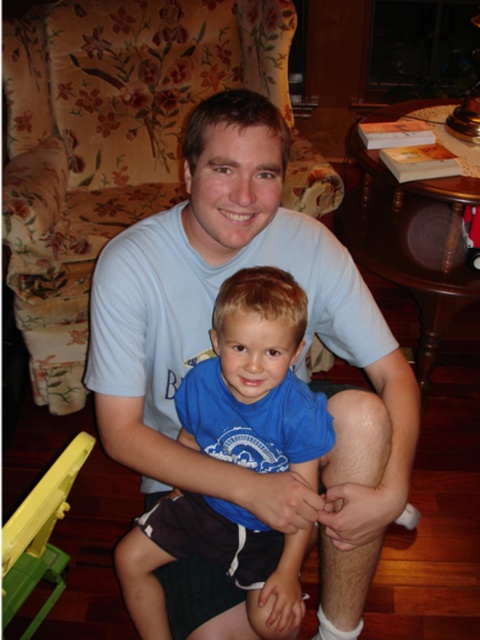
You are a photographer setting up for a family portrait. The floral fabric armchair at upper left is in the scene. To ensure both the subjects and the armchair are in focus, what should be the minimum distance you set your camera focus? Please provide your answer in feet based on the given information.

The floral fabric armchair at upper left is 5.33 feet from the camera. To ensure both the subjects and the armchair are in focus, the minimum focus distance should be set to 5.33 feet.

You are standing in the room where the father and son are sitting. You want to move from the floral fabric armchair at upper left to the blue cotton shirt at center. Which direction should you move?

The floral fabric armchair at upper left is located above the blue cotton shirt at center, so you should move downward to reach the blue cotton shirt at center.